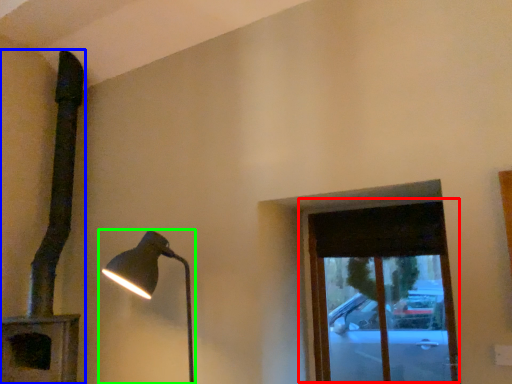
Question: Which is nearer to the window (highlighted by a red box)? lamp (highlighted by a blue box) or lamp (highlighted by a green box).

Choices:
 (A) lamp
 (B) lamp

Answer: (B)